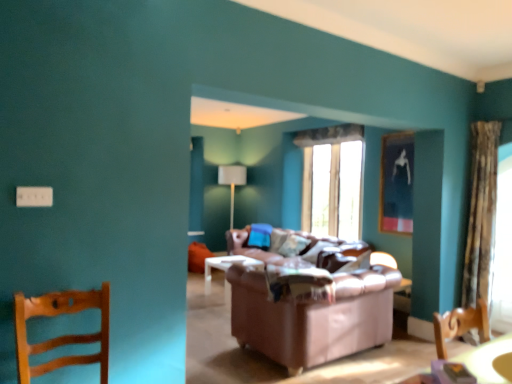
Question: Would you say wooden chair at left is to the left or to the right of metallic silver picture frame at upper right in the picture?

Choices:
 (A) right
 (B) left

Answer: (B)

Question: Is point (105, 367) positioned closer to the camera than point (412, 196)?

Choices:
 (A) closer
 (B) farther

Answer: (A)

Question: Which of these objects is positioned farthest from the metallic silver picture frame at upper right?

Choices:
 (A) patterned fabric curtain at right
 (B) transparent fabric at right
 (C) wooden chair at left
 (D) white fabric lampshade at center
 (E) transparent glass window at center

Answer: (C)

Question: Based on their relative distances, which object is farther from the metallic silver picture frame at upper right?

Choices:
 (A) wooden chair at left
 (B) patterned fabric curtain at right
 (C) transparent fabric at right
 (D) brown leather couch at center
 (E) transparent glass window at center

Answer: (A)